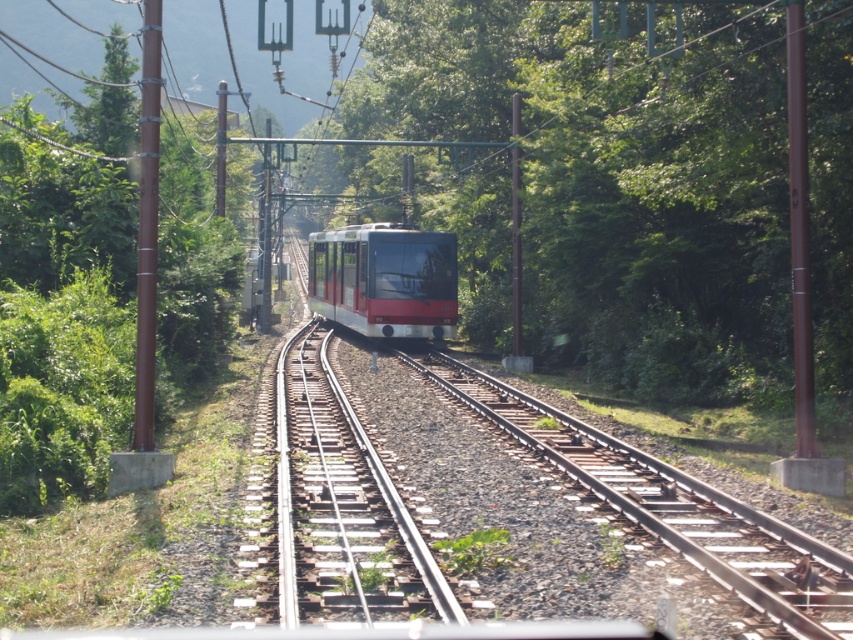
Looking at this image, you are a passenger on the train and looking out the window. You notice the green leafy tree at center. Can you determine if the tree is closer to the front or the back of the train based on its position?

The green leafy tree at center is located at point [616,182], which places it closer to the back of the train since the train is moving towards the viewer and positioned centrally. Therefore, the tree is behind the train relative to its direction of travel.